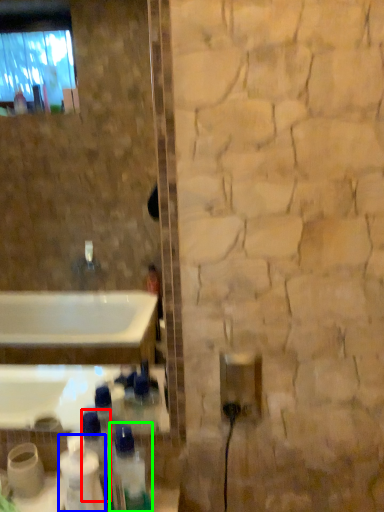
Question: Which object is the farthest from bottle (highlighted by a red box)? Choose among these: cleaning product (highlighted by a blue box) or bottle (highlighted by a green box).

Choices:
 (A) cleaning product
 (B) bottle

Answer: (B)